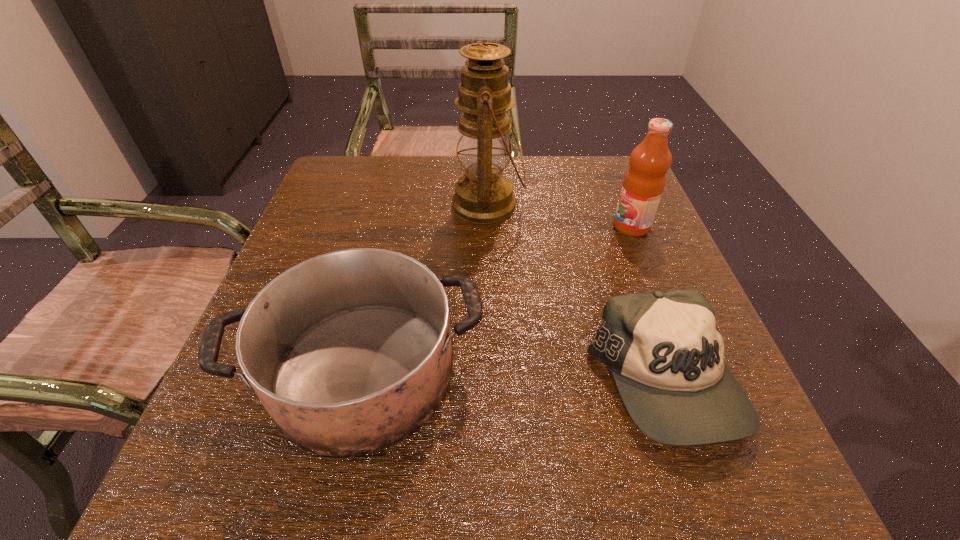
Image resolution: width=960 pixels, height=540 pixels. I want to click on object that ranks as the third closest to the baseball cap, so click(483, 195).

Locate an element on the screen. This screenshot has width=960, height=540. object that is the second closest to the saucepan is located at coordinates (483, 195).

This screenshot has height=540, width=960. What are the coordinates of `blank space that satisfies the following two spatial constraints: 1. on the front label of the fruit juice; 2. on the front side of the third tallest object` in the screenshot? It's located at (689, 372).